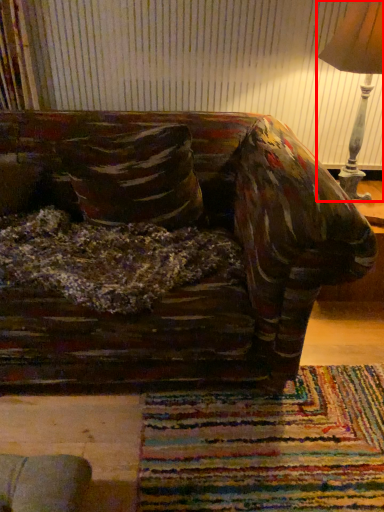
Question: From the image's perspective, considering the relative positions of lamp (annotated by the red box) and throw pillow in the image provided, where is lamp (annotated by the red box) located with respect to the staircase?

Choices:
 (A) below
 (B) above

Answer: (B)